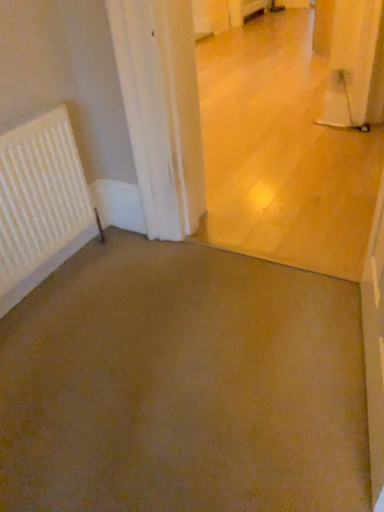
Question: Does brown carpet at lower left, arranged as the second concrete when viewed from the top, have a lesser height compared to white matte radiator at left?

Choices:
 (A) yes
 (B) no

Answer: (A)

Question: Is brown carpet at lower left, arranged as the second concrete when viewed from the top, wider than white matte radiator at left?

Choices:
 (A) no
 (B) yes

Answer: (B)

Question: From a real-world perspective, is brown carpet at lower left, arranged as the second concrete when viewed from the top, below white matte radiator at left?

Choices:
 (A) no
 (B) yes

Answer: (B)

Question: Considering the relative sizes of brown carpet at lower left, arranged as the second concrete when viewed from the top, and white matte radiator at left in the image provided, is brown carpet at lower left, arranged as the second concrete when viewed from the top, taller than white matte radiator at left?

Choices:
 (A) no
 (B) yes

Answer: (A)

Question: Does brown carpet at lower left, arranged as the second concrete when viewed from the top, appear on the left side of white matte radiator at left?

Choices:
 (A) yes
 (B) no

Answer: (B)

Question: Is brown carpet at lower left, arranged as the second concrete when viewed from the top, positioned far away from white matte radiator at left?

Choices:
 (A) yes
 (B) no

Answer: (B)

Question: Is the position of brown matte concrete at center, the 1th concrete viewed from the top, less distant than that of brown carpet at lower left, the first concrete when ordered from bottom to top?

Choices:
 (A) yes
 (B) no

Answer: (B)

Question: Is brown matte concrete at center, marked as the second concrete in a bottom-to-top arrangement, oriented away from brown carpet at lower left, the first concrete when ordered from bottom to top?

Choices:
 (A) no
 (B) yes

Answer: (A)

Question: Are brown matte concrete at center, marked as the second concrete in a bottom-to-top arrangement, and brown carpet at lower left, the first concrete when ordered from bottom to top, located far from each other?

Choices:
 (A) no
 (B) yes

Answer: (A)

Question: Is brown matte concrete at center, marked as the second concrete in a bottom-to-top arrangement, smaller than brown carpet at lower left, arranged as the second concrete when viewed from the top?

Choices:
 (A) yes
 (B) no

Answer: (B)

Question: Can you confirm if brown matte concrete at center, marked as the second concrete in a bottom-to-top arrangement, is wider than brown carpet at lower left, arranged as the second concrete when viewed from the top?

Choices:
 (A) no
 (B) yes

Answer: (A)

Question: Does brown matte concrete at center, the 1th concrete viewed from the top, have a lesser width compared to brown carpet at lower left, the first concrete when ordered from bottom to top?

Choices:
 (A) no
 (B) yes

Answer: (B)

Question: Considering the relative sizes of brown matte concrete at center, marked as the second concrete in a bottom-to-top arrangement, and white matte radiator at left in the image provided, is brown matte concrete at center, marked as the second concrete in a bottom-to-top arrangement, smaller than white matte radiator at left?

Choices:
 (A) yes
 (B) no

Answer: (B)